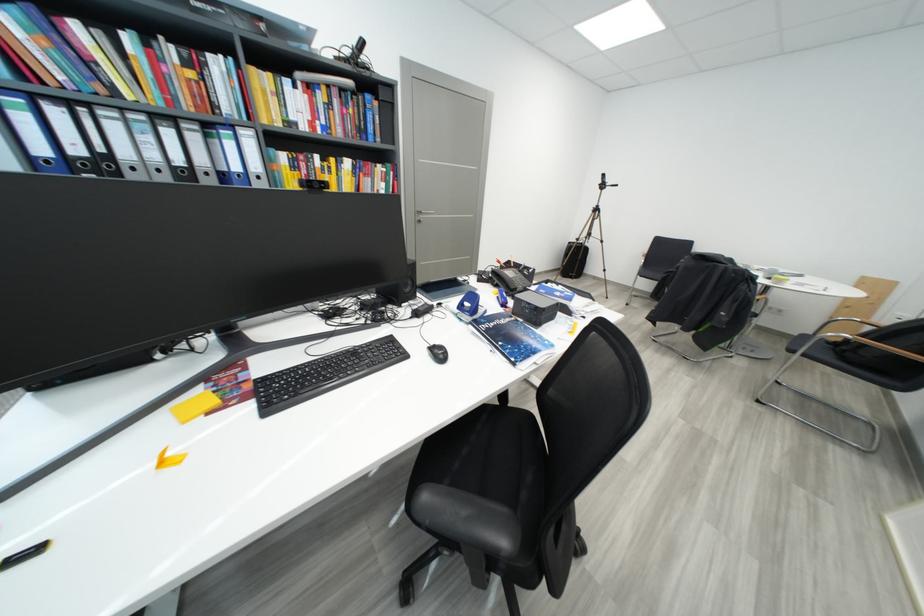
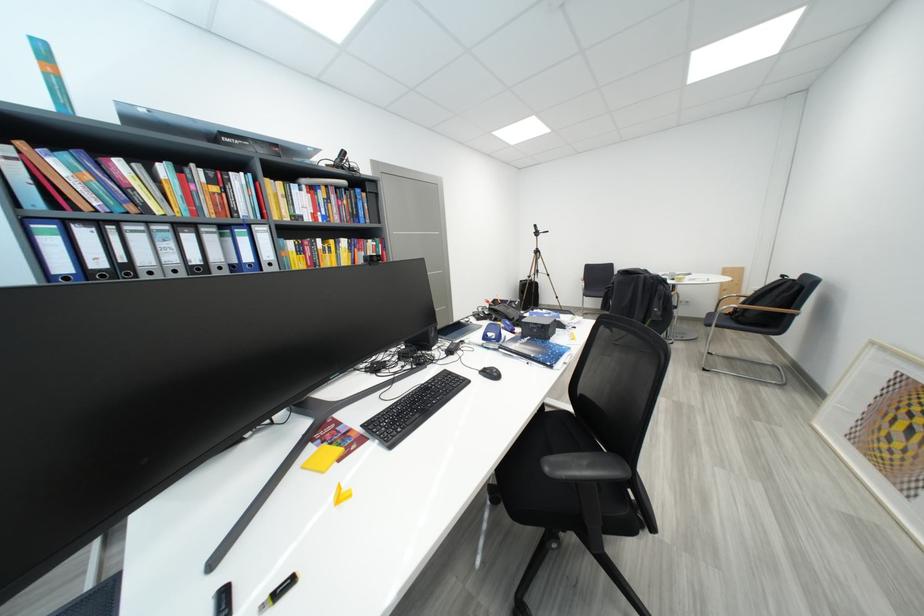
Where in the second image is the point corresponding to pixel 697 246 from the first image?

(618, 269)